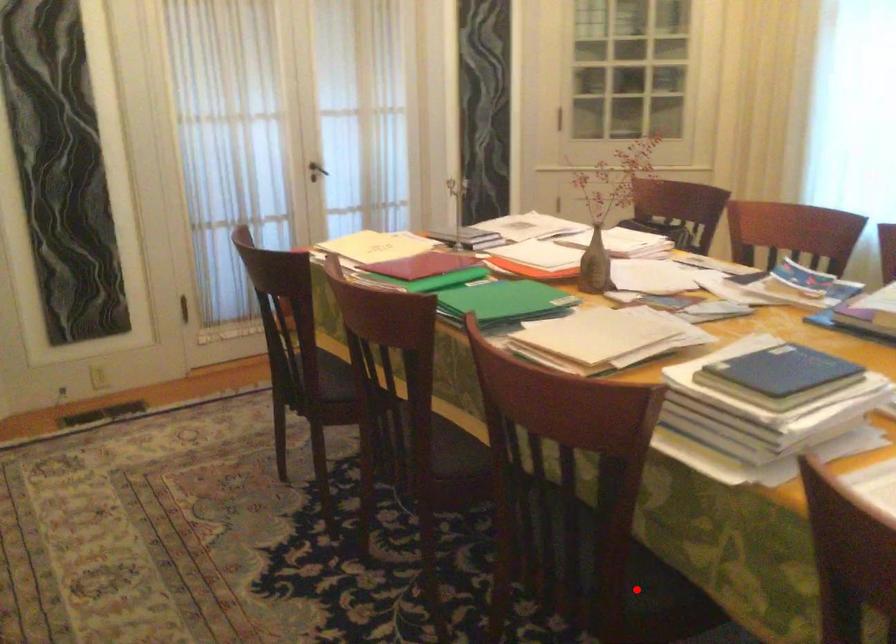
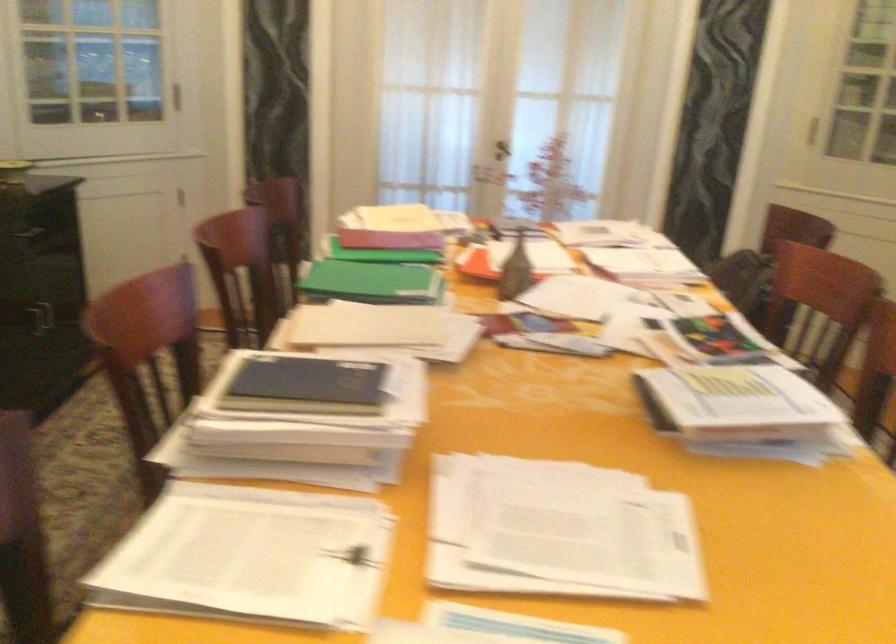
Question: I am providing you with two images of the same scene from different viewpoints. A red point is marked on the first image. Can you still see the location of the red point in image 2?

Choices:
 (A) Yes
 (B) No

Answer: (B)